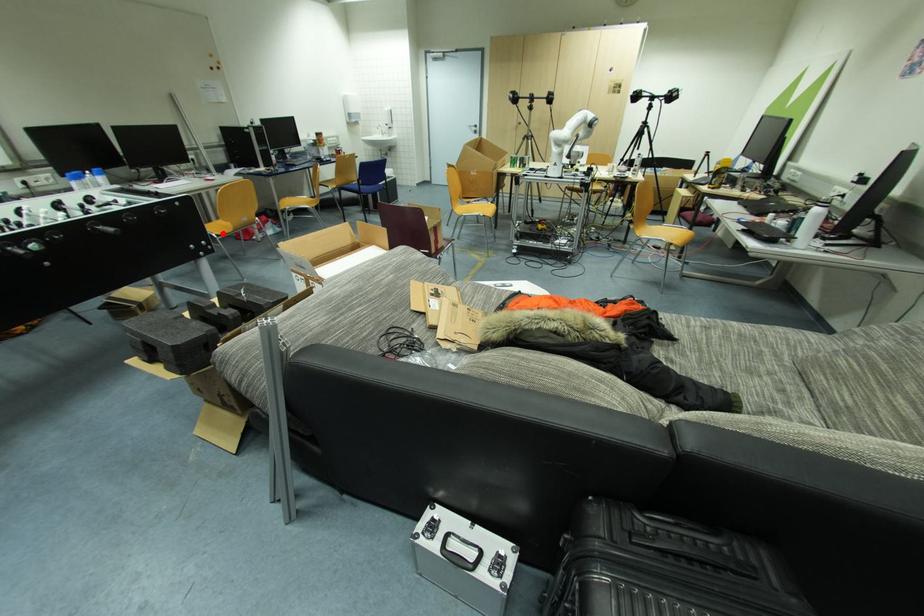
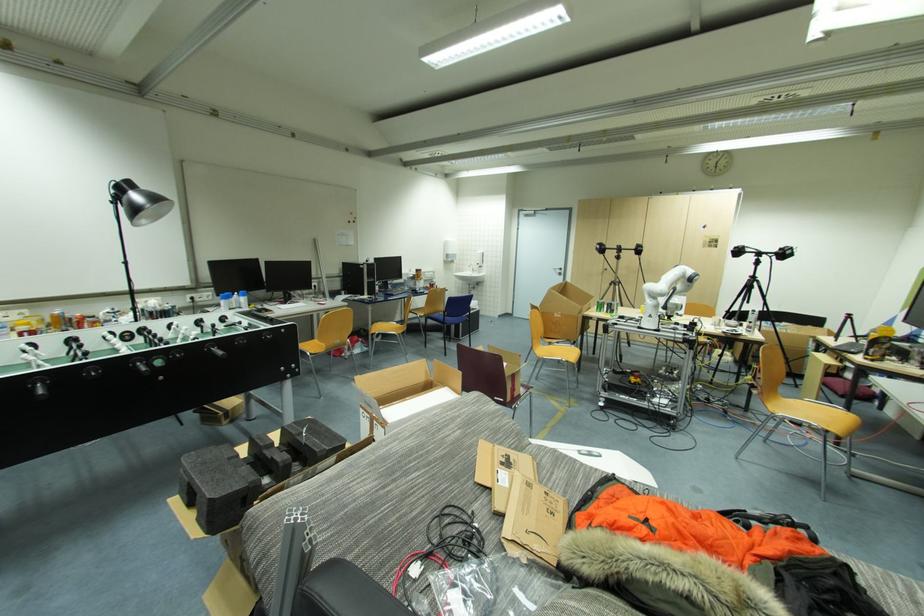
In the second image, find the point that corresponds to the highlighted location in the first image.

(315, 353)